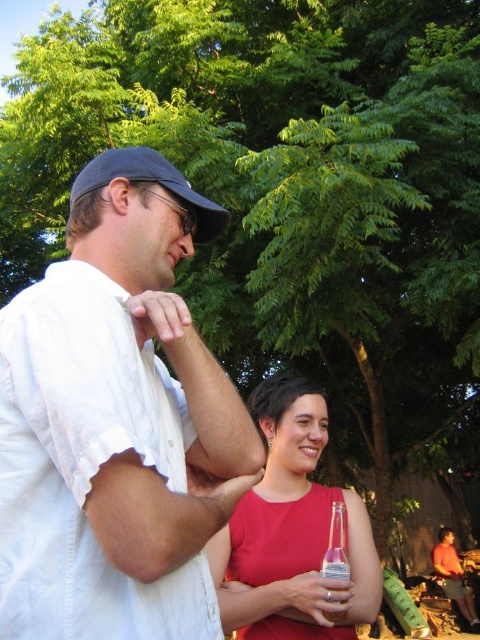
Question: Is matte red dress at center above clear glass bottle at center?

Choices:
 (A) no
 (B) yes

Answer: (B)

Question: Which point is farther to the camera?

Choices:
 (A) clear glass bottle at center
 (B) matte red dress at center

Answer: (A)

Question: Which object is farther from the camera taking this photo?

Choices:
 (A) matte red dress at center
 (B) white cotton shirt at left
 (C) clear glass bottle at center

Answer: (C)

Question: Which of these objects is positioned farthest from the matte red dress at center?

Choices:
 (A) clear glass bottle at center
 (B) white cotton shirt at left

Answer: (B)

Question: Is white cotton shirt at left smaller than clear glass bottle at center?

Choices:
 (A) no
 (B) yes

Answer: (A)

Question: Where is white cotton shirt at left located in relation to clear glass bottle at center in the image?

Choices:
 (A) above
 (B) below

Answer: (A)